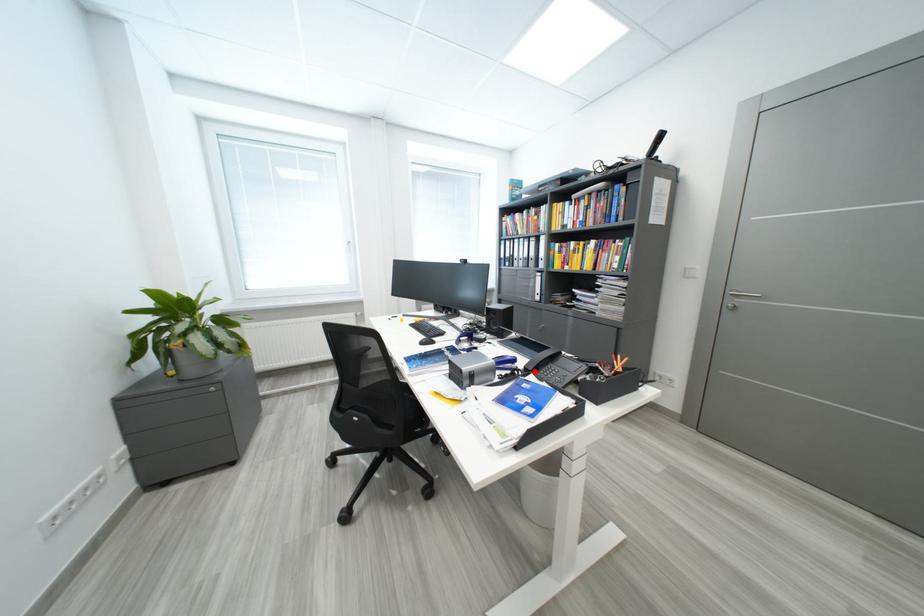
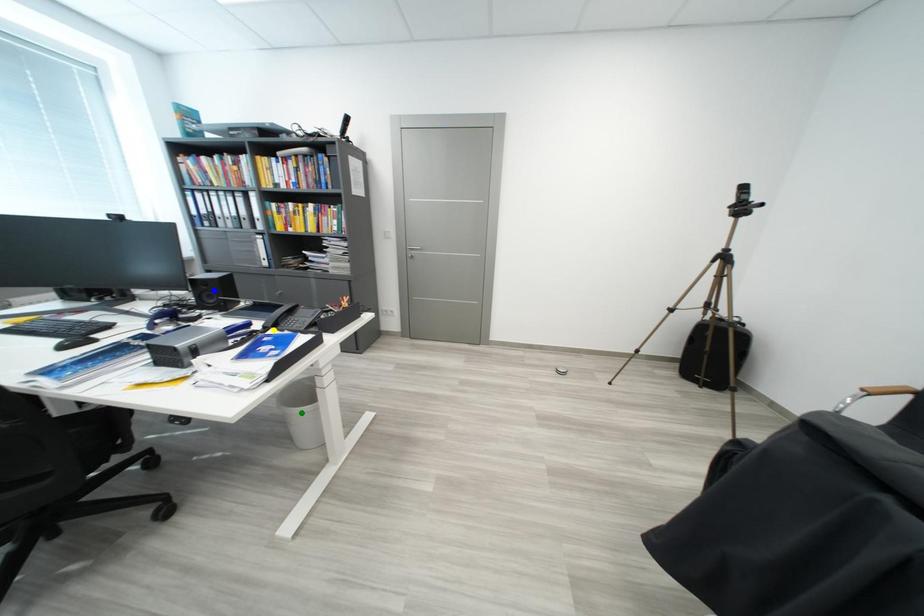
Question: I am providing you with two images of the same scene from different viewpoints. A red point is marked on the first image. You are given multiple points on the second image. In image 2, which mark is for the same physical point as the one in image 1?

Choices:
 (A) green point
 (B) yellow point
 (C) blue point

Answer: (B)